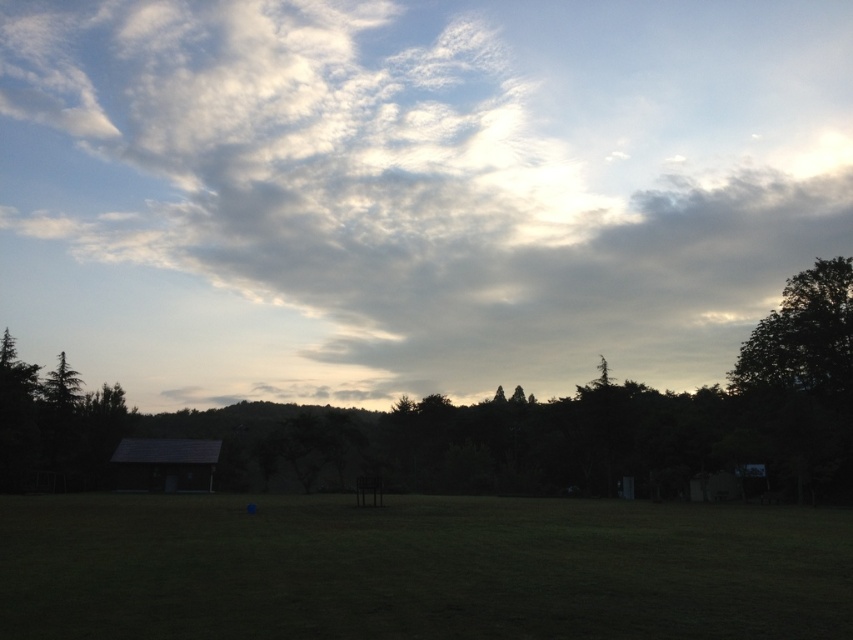
Question: Does dark green leafy tree at right lie in front of green matte tree at left?

Choices:
 (A) yes
 (B) no

Answer: (A)

Question: Is green grassy field at center wider than green matte tree at left?

Choices:
 (A) no
 (B) yes

Answer: (B)

Question: Which point appears closest to the camera in this image?

Choices:
 (A) (778, 413)
 (B) (363, 624)
 (C) (138, 472)
 (D) (730, 122)

Answer: (B)

Question: Is dark green leafy tree at right thinner than green matte tree at left?

Choices:
 (A) no
 (B) yes

Answer: (A)

Question: Among these objects, which one is nearest to the camera?

Choices:
 (A) green matte tree at left
 (B) dark green leafy tree at right
 (C) green grassy field at center

Answer: (C)

Question: Which point is farther from the camera taking this photo?

Choices:
 (A) (42, 611)
 (B) (769, 314)

Answer: (B)